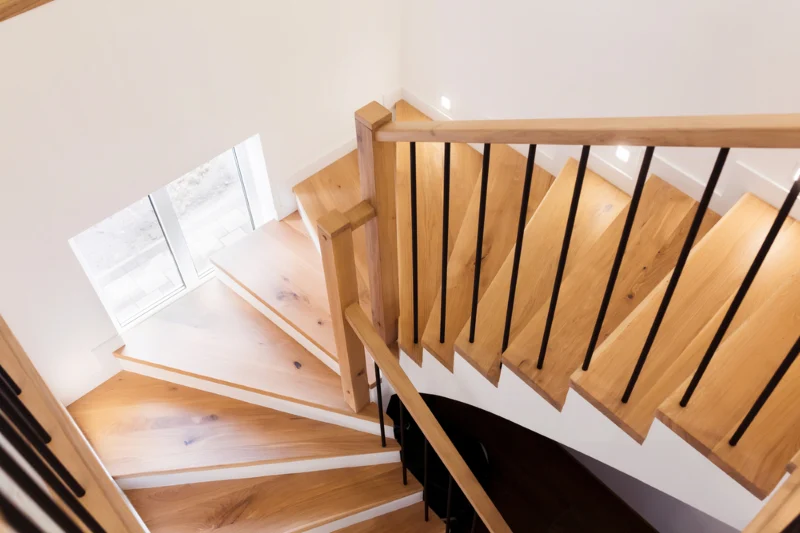
Where is `stairs`? The image size is (800, 533). stairs is located at coordinates (752, 365), (692, 317), (641, 259), (593, 204), (501, 195), (284, 266), (237, 353), (229, 435), (304, 498).